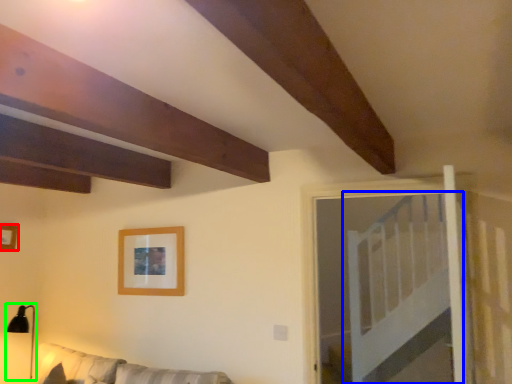
Question: Estimate the real-world distances between objects in this image. Which object is farther from picture frame (highlighted by a red box), bed (highlighted by a blue box) or lamp (highlighted by a green box)?

Choices:
 (A) bed
 (B) lamp

Answer: (A)